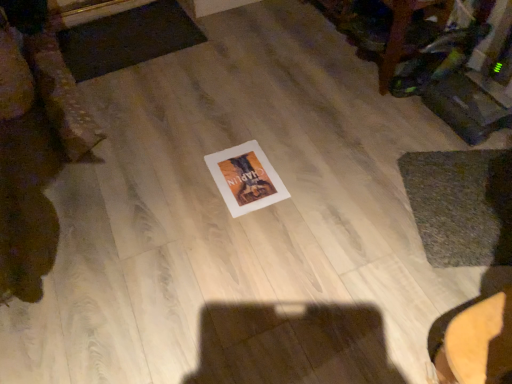
Question: Is dark gray textured mat at upper left, which is the 2th mat in right-to-left order, turned away from white paper at center?

Choices:
 (A) no
 (B) yes

Answer: (A)

Question: Could you tell me if dark gray textured mat at upper left, which is the 1th mat from left to right, is turned towards white paper at center?

Choices:
 (A) yes
 (B) no

Answer: (A)

Question: Are dark gray textured mat at upper left, which is counted as the second mat, starting from the front, and white paper at center located far from each other?

Choices:
 (A) no
 (B) yes

Answer: (A)

Question: Is dark gray textured mat at upper left, placed as the 2th mat when sorted from bottom to top, further to the viewer compared to white paper at center?

Choices:
 (A) no
 (B) yes

Answer: (B)

Question: Would you say dark gray textured mat at upper left, which is the 1th mat from left to right, is outside white paper at center?

Choices:
 (A) no
 (B) yes

Answer: (B)

Question: From the image's perspective, is dark gray textured mat at upper left, which is counted as the second mat, starting from the front, above white paper at center?

Choices:
 (A) no
 (B) yes

Answer: (B)

Question: Can you confirm if dark gray textured mat at upper left, which is counted as the second mat, starting from the front, is bigger than green textured mat at lower right, which is counted as the 2th mat, starting from the left?

Choices:
 (A) yes
 (B) no

Answer: (A)

Question: From the image's perspective, is dark gray textured mat at upper left, placed as the 2th mat when sorted from bottom to top, over green textured mat at lower right, which appears as the 1th mat when viewed from the front?

Choices:
 (A) no
 (B) yes

Answer: (B)

Question: Can you confirm if dark gray textured mat at upper left, which is counted as the second mat, starting from the front, is shorter than green textured mat at lower right, the 1th mat in the right-to-left sequence?

Choices:
 (A) no
 (B) yes

Answer: (B)

Question: Considering the relative sizes of dark gray textured mat at upper left, which appears as the 1th mat when viewed from the top, and green textured mat at lower right, which appears as the 1th mat when viewed from the front, in the image provided, is dark gray textured mat at upper left, which appears as the 1th mat when viewed from the top, wider than green textured mat at lower right, which appears as the 1th mat when viewed from the front,?

Choices:
 (A) no
 (B) yes

Answer: (B)

Question: Considering the relative sizes of dark gray textured mat at upper left, placed as the 2th mat when sorted from bottom to top, and green textured mat at lower right, which is counted as the 2th mat, starting from the back, in the image provided, is dark gray textured mat at upper left, placed as the 2th mat when sorted from bottom to top, taller than green textured mat at lower right, which is counted as the 2th mat, starting from the back,?

Choices:
 (A) no
 (B) yes

Answer: (A)

Question: From the image's perspective, is dark gray textured mat at upper left, placed as the 2th mat when sorted from bottom to top, beneath green textured mat at lower right, which is counted as the 2th mat, starting from the back?

Choices:
 (A) no
 (B) yes

Answer: (A)

Question: Can you confirm if wooden table at upper right is bigger than dark gray textured mat at upper left, the 1th mat viewed from the back?

Choices:
 (A) no
 (B) yes

Answer: (B)